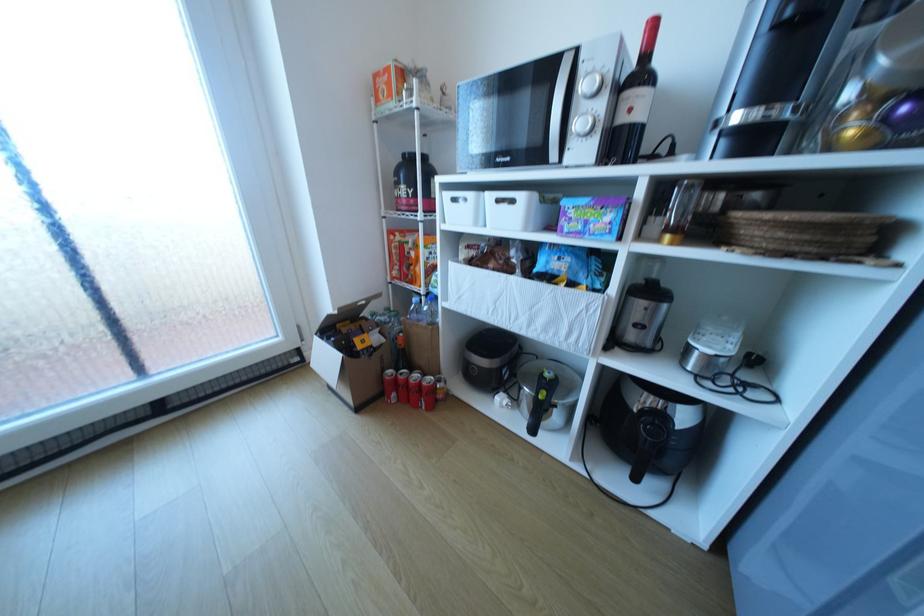
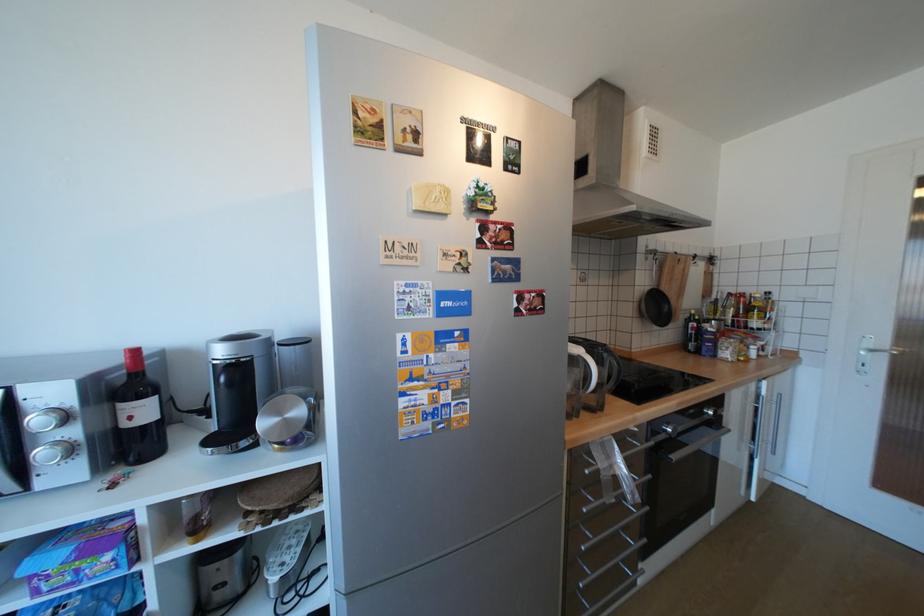
Question: The images are taken continuously from a first-person perspective. In which direction is your viewpoint rotating?

Choices:
 (A) Left
 (B) Right
 (C) Up
 (D) Down

Answer: (B)